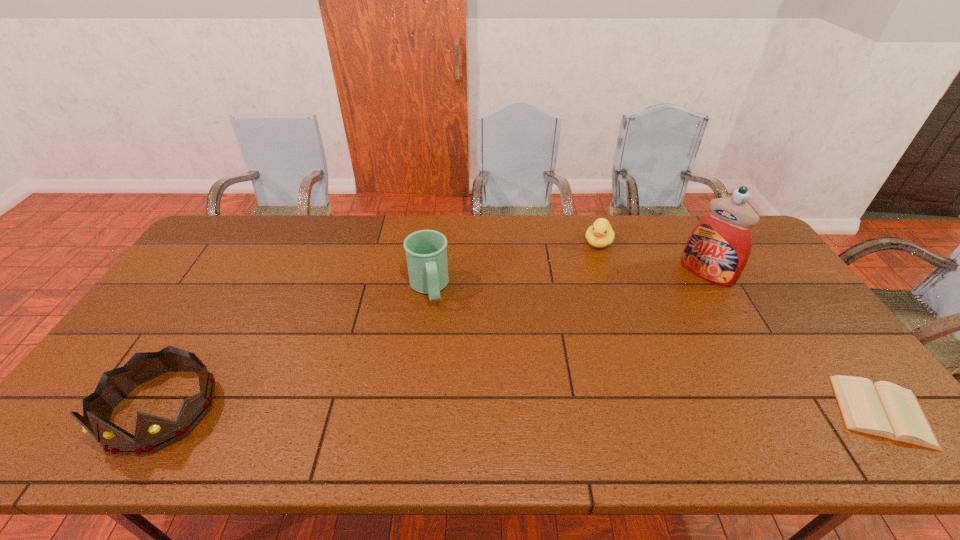
Locate an element on the screen. The width and height of the screenshot is (960, 540). vacant point located between the third shortest object and the leftmost object is located at coordinates (295, 349).

I want to click on blank region between the farthest object and the detergent, so point(652,258).

The width and height of the screenshot is (960, 540). I want to click on free space between the fourth object from right to left and the tiara, so click(295, 349).

Identify which object is located as the fourth nearest to the detergent. Please provide its 2D coordinates. Your answer should be formatted as a tuple, i.e. [(x, y)], where the tuple contains the x and y coordinates of a point satisfying the conditions above.

[(153, 433)]

Where is `object that is the nearest to the third object from right to left`? object that is the nearest to the third object from right to left is located at coordinates (718, 248).